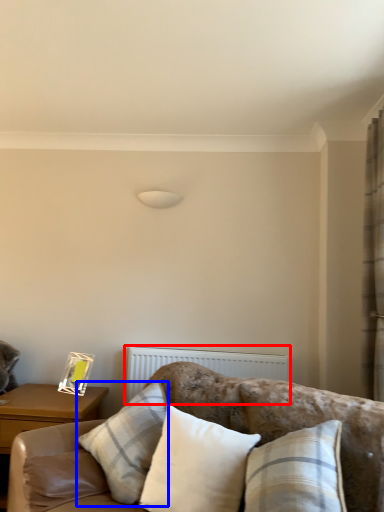
Question: Among these objects, which one is nearest to the camera, radiator (highlighted by a red box) or pillow (highlighted by a blue box)?

Choices:
 (A) radiator
 (B) pillow

Answer: (B)